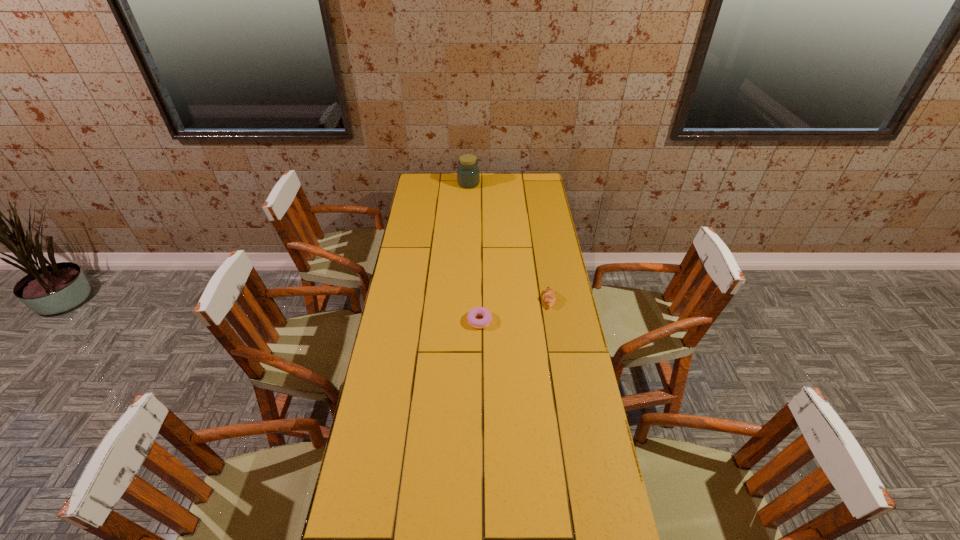
You are a GUI agent. You are given a task and a screenshot of the screen. Output one action in this format:
    pyautogui.click(x=<x>, y=<y>)
    Task: Click on the blank region between the left pastry and the rightmost object
    
    Given the screenshot: What is the action you would take?
    pyautogui.click(x=514, y=310)

I want to click on free area in between the tallest object and the nearest object, so click(x=474, y=252).

The height and width of the screenshot is (540, 960). In order to click on object that stands as the closest to the shorter pastry in this screenshot , I will do `click(549, 297)`.

Select which object appears as the closest to the shortest object. Please provide its 2D coordinates. Your answer should be formatted as a tuple, i.e. [(x, y)], where the tuple contains the x and y coordinates of a point satisfying the conditions above.

[(549, 297)]

This screenshot has width=960, height=540. Identify the location of vacant space that satisfies the following two spatial constraints: 1. on the front-facing side of the rightmost object; 2. on the front side of the shorter pastry. (552, 321).

The image size is (960, 540). I want to click on free space that satisfies the following two spatial constraints: 1. on the front-facing side of the second nearest object; 2. on the front side of the left pastry, so click(552, 321).